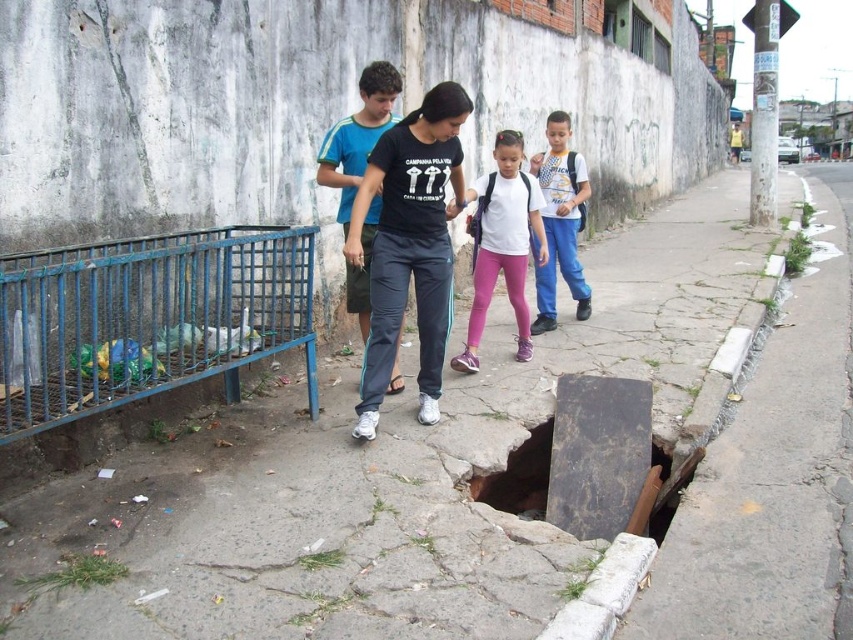
You are a photographer trying to capture a photo of the dark blue track pants at center and the white matte shirt at center. Which one should you focus on first if you want to capture both in the same frame without moving the camera?

The dark blue track pants at center is positioned on the left side of white matte shirt at center, so you should focus on the dark blue track pants at center first to ensure both are in the frame.

You are a photographer trying to capture a clear shot of both the dark blue track pants at center and the white matte shirt at center. Since you want both subjects to be in focus, which one should you adjust your camera focus on first?

You should focus on the dark blue track pants at center first because it is closer to the viewer than the white matte shirt at center. By focusing on the closer object, the farther one will also be in focus due to the depth of field.